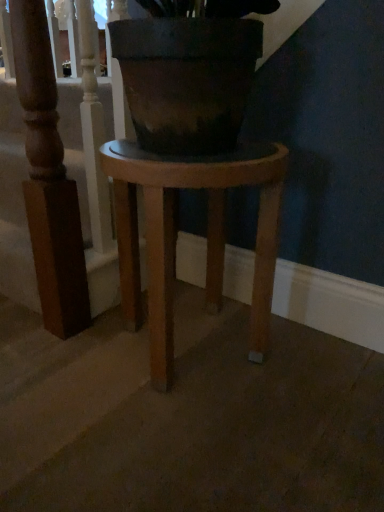
Where is `free spot to the right of wooden stool at center`? This screenshot has height=512, width=384. free spot to the right of wooden stool at center is located at coordinates (316, 372).